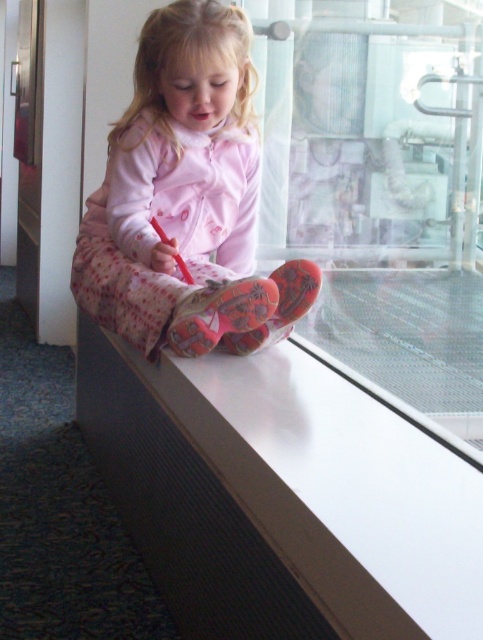
Question: Can you confirm if white smooth ledge at center is positioned to the right of transparent glass window at center?

Choices:
 (A) yes
 (B) no

Answer: (B)

Question: Which point appears farthest from the camera in this image?

Choices:
 (A) (230, 145)
 (B) (347, 196)

Answer: (B)

Question: In this image, where is white smooth ledge at center located relative to pink fleece pajamas at center?

Choices:
 (A) below
 (B) above

Answer: (A)

Question: Which point is closer to the camera taking this photo?

Choices:
 (A) (454, 161)
 (B) (393, 445)
 (C) (168, 291)

Answer: (B)

Question: Can you confirm if white smooth ledge at center is wider than transparent glass window at center?

Choices:
 (A) yes
 (B) no

Answer: (B)

Question: Which object appears farthest from the camera in this image?

Choices:
 (A) pink fleece pajamas at center
 (B) white smooth ledge at center
 (C) transparent glass window at center

Answer: (A)